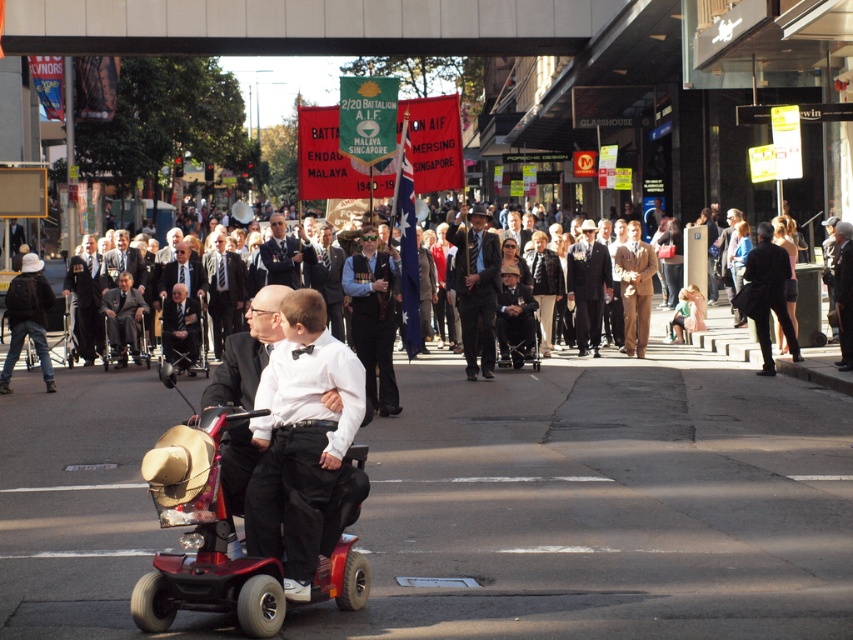
Is point (257, 614) closer to camera compared to point (173, 314)?

That is True.

Is point (164, 477) behind point (193, 333)?

No, (164, 477) is closer to viewer.

Is point (234, 593) closer to viewer compared to point (175, 284)?

Yes, point (234, 593) is closer to viewer.

The width and height of the screenshot is (853, 640). Identify the location of red plastic mobility scooter at lower left. (204, 531).

Consider the image. Between dark blue suit at center and dark blue uniform at center, which one has more height?

dark blue suit at center is taller.

Measure the distance between dark blue suit at center and dark blue uniform at center.

dark blue suit at center is 3.64 meters away from dark blue uniform at center.

Which is behind, point (358, 317) or point (286, 264)?

The point (286, 264) is behind.

Locate an element on the screen. The height and width of the screenshot is (640, 853). dark blue suit at center is located at coordinates (373, 317).

Between dark suit at center and dark blue uniform at center, which one has less height?

dark blue uniform at center

Does dark suit at center appear on the left side of dark blue uniform at center?

Yes, dark suit at center is to the left of dark blue uniform at center.

Locate an element on the screen. dark suit at center is located at coordinates (180, 326).